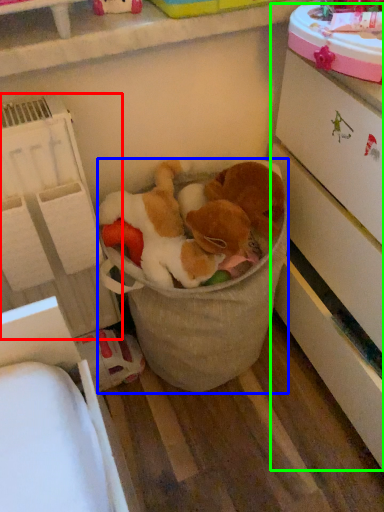
Question: Which object is the closest to the shelf (highlighted by a red box)? Choose among these: toy (highlighted by a blue box) or cabinetry (highlighted by a green box).

Choices:
 (A) toy
 (B) cabinetry

Answer: (A)